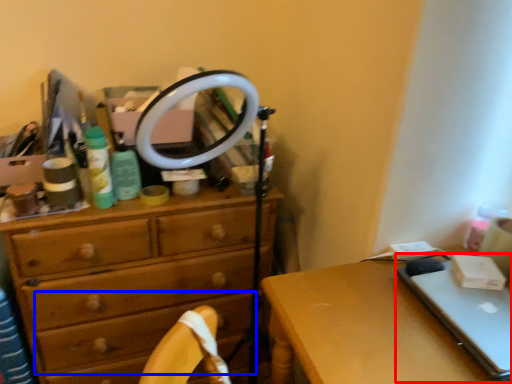
Question: Which point is further to the camera, laptop (highlighted by a red box) or drawer (highlighted by a blue box)?

Choices:
 (A) laptop
 (B) drawer

Answer: (A)